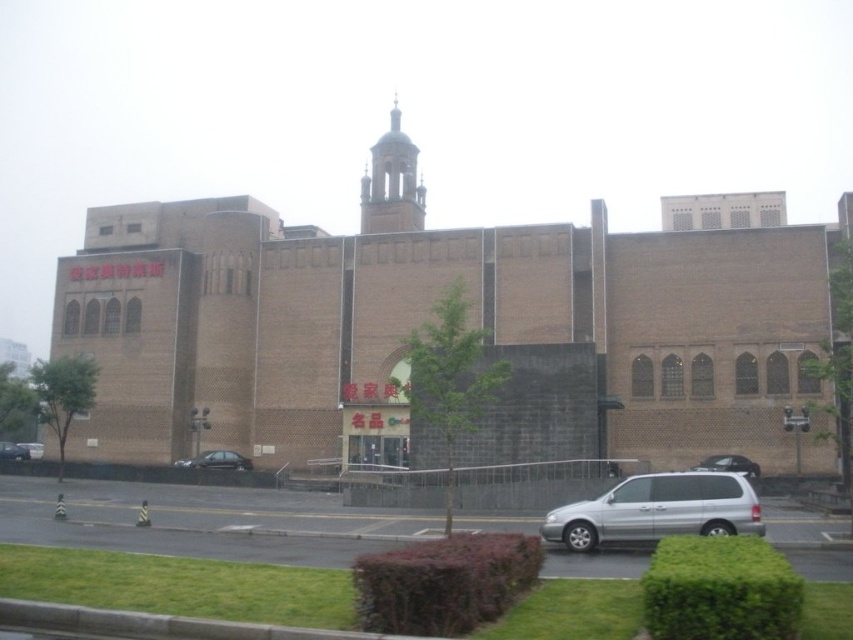
Question: Based on their relative distances, which object is farther from the black matte car at center?

Choices:
 (A) silver metallic van at center
 (B) satin black sedan at lower right
 (C) shiny black sedan at lower left
 (D) matte black sedan at lower left

Answer: (B)

Question: Which point appears farthest from the camera in this image?

Choices:
 (A) (733, 472)
 (B) (28, 456)
 (C) (3, 449)

Answer: (B)

Question: Can you confirm if silver metallic van at center is positioned to the right of satin black sedan at lower right?

Choices:
 (A) no
 (B) yes

Answer: (A)

Question: Which of the following is the farthest from the observer?

Choices:
 (A) pos(233,461)
 (B) pos(18,451)

Answer: (B)

Question: Observing the image, what is the correct spatial positioning of silver metallic van at center in reference to satin black sedan at lower right?

Choices:
 (A) below
 (B) above

Answer: (B)

Question: Can you confirm if satin black sedan at lower right is bigger than matte black sedan at lower left?

Choices:
 (A) no
 (B) yes

Answer: (A)